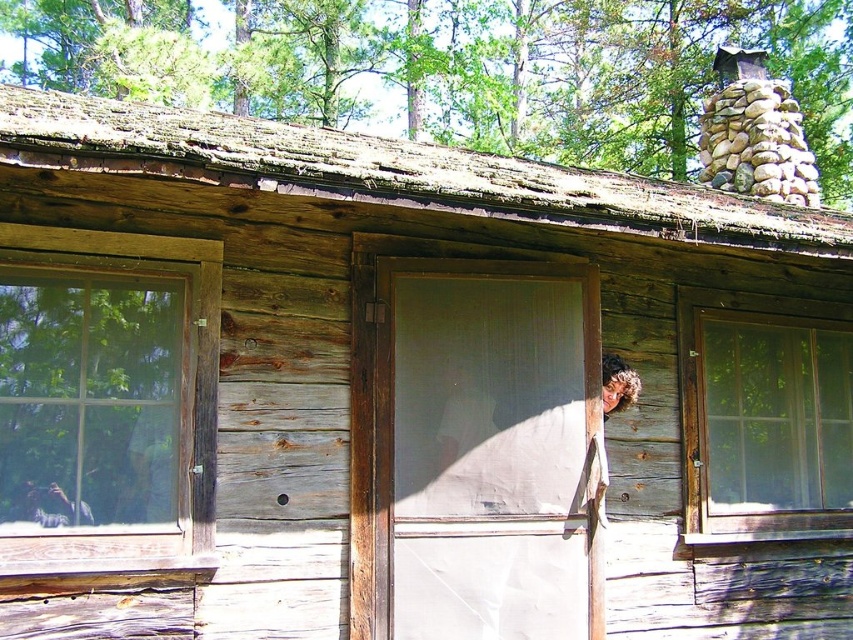
The image size is (853, 640). What do you see at coordinates (392, 172) in the screenshot?
I see `weathered wood roof at upper center` at bounding box center [392, 172].

Is point (549, 202) behind point (83, 522)?

No, it is in front of (83, 522).

The width and height of the screenshot is (853, 640). Find the location of `weathered wood roof at upper center`. weathered wood roof at upper center is located at coordinates (392, 172).

Which is behind, point (4, 307) or point (757, 433)?

The point (757, 433) is more distant.

Is point (4, 323) farther from camera compared to point (740, 340)?

No, it is in front of (740, 340).

You are a GUI agent. You are given a task and a screenshot of the screen. Output one action in this format:
    pyautogui.click(x=<x>, y=<y>)
    Task: Click on the clear glass window at left
    The width and height of the screenshot is (853, 640).
    Given the screenshot: What is the action you would take?
    pyautogui.click(x=93, y=401)

Does weathered wood roof at upper center have a lesser height compared to clear glass window at right?

Indeed, weathered wood roof at upper center has a lesser height compared to clear glass window at right.

Which of these two, weathered wood roof at upper center or clear glass window at right, stands taller?

clear glass window at right

Between point (363, 186) and point (734, 540), which one is positioned behind?

Point (734, 540)

Identify the location of weathered wood roof at upper center. The image size is (853, 640). (392, 172).